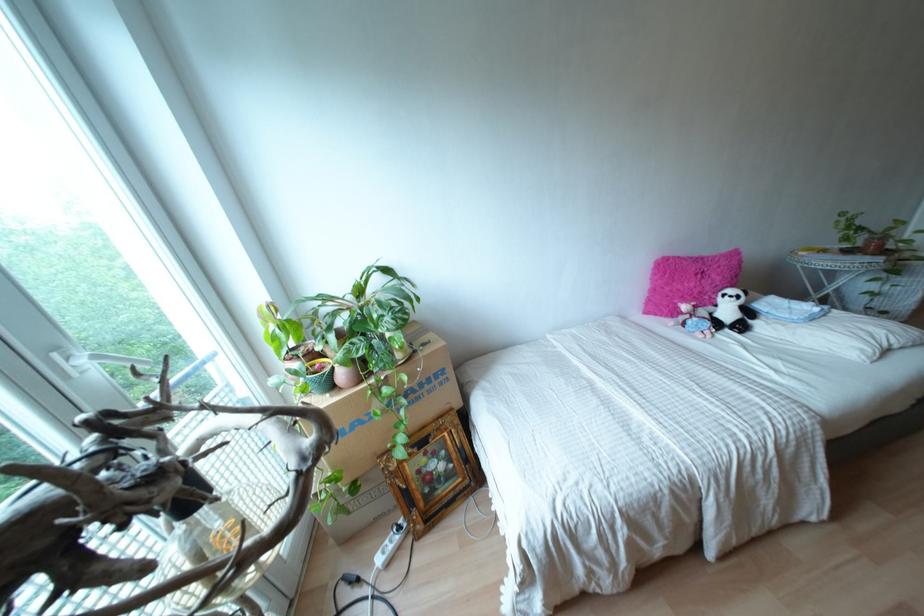
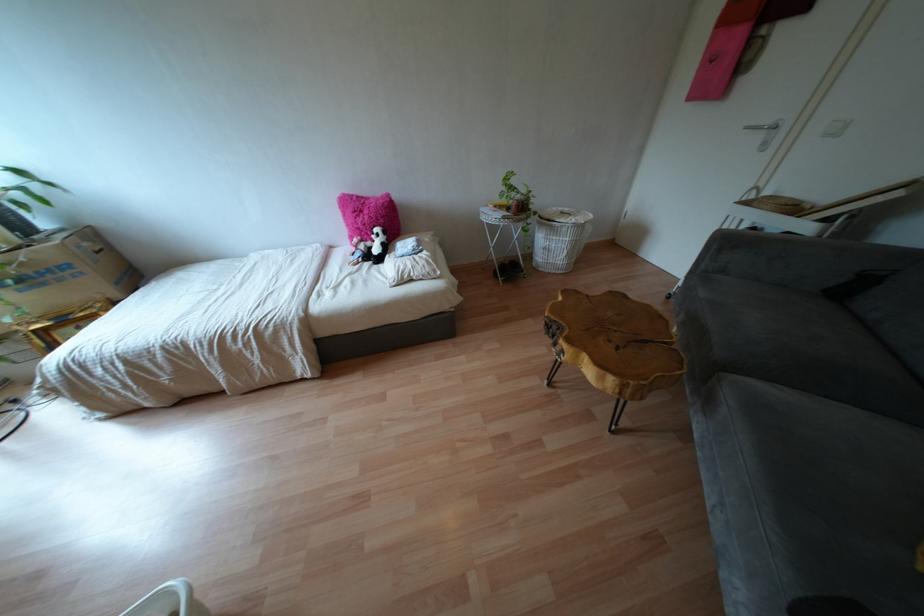
Find the pixel in the second image that matches the point at 747,312 in the first image.

(385, 248)